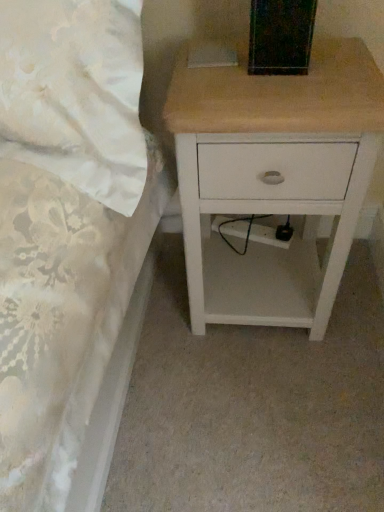
Question: Is white fabric bed at upper left inside the boundaries of white wood nightstand at upper right, or outside?

Choices:
 (A) outside
 (B) inside

Answer: (A)

Question: From the image's perspective, relative to white wood nightstand at upper right, is white fabric bed at upper left above or below?

Choices:
 (A) above
 (B) below

Answer: (A)

Question: From a real-world perspective, is white fabric bed at upper left above or below white wood nightstand at upper right?

Choices:
 (A) below
 (B) above

Answer: (B)

Question: Considering the positions of white wood nightstand at upper right and white fabric bed at upper left in the image, is white wood nightstand at upper right bigger or smaller than white fabric bed at upper left?

Choices:
 (A) big
 (B) small

Answer: (B)

Question: Is point (314, 204) positioned closer to the camera than point (11, 210)?

Choices:
 (A) farther
 (B) closer

Answer: (A)

Question: In terms of width, does white wood nightstand at upper right look wider or thinner when compared to white fabric bed at upper left?

Choices:
 (A) thin
 (B) wide

Answer: (B)

Question: Is white wood nightstand at upper right in front of or behind white fabric bed at upper left in the image?

Choices:
 (A) behind
 (B) front

Answer: (A)